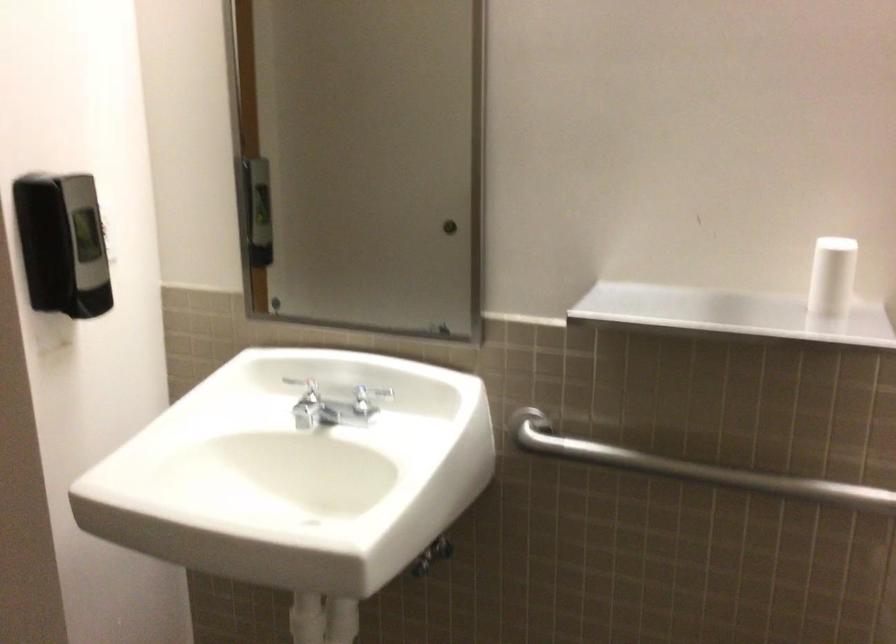
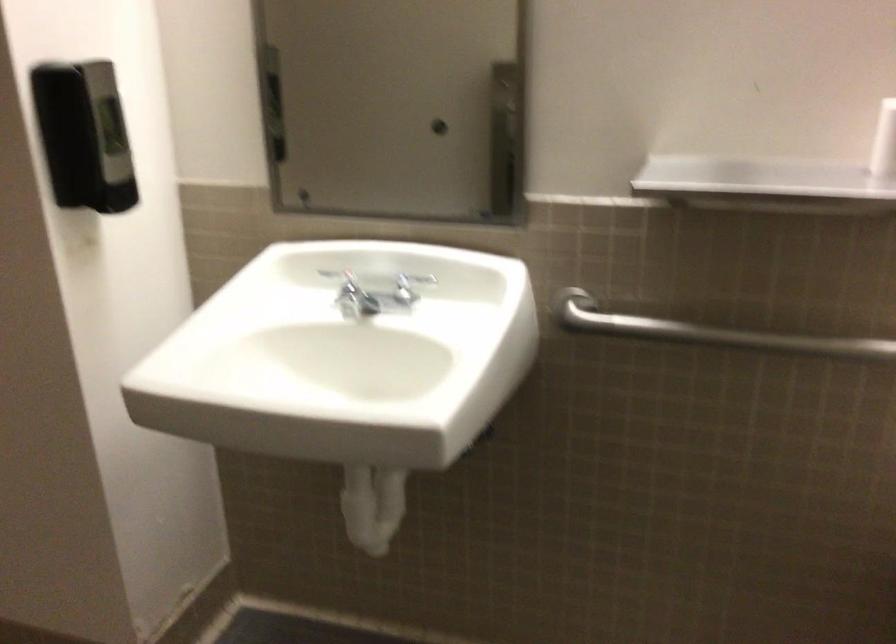
Find the pixel in the second image that matches (x=308, y=400) in the first image.

(346, 290)